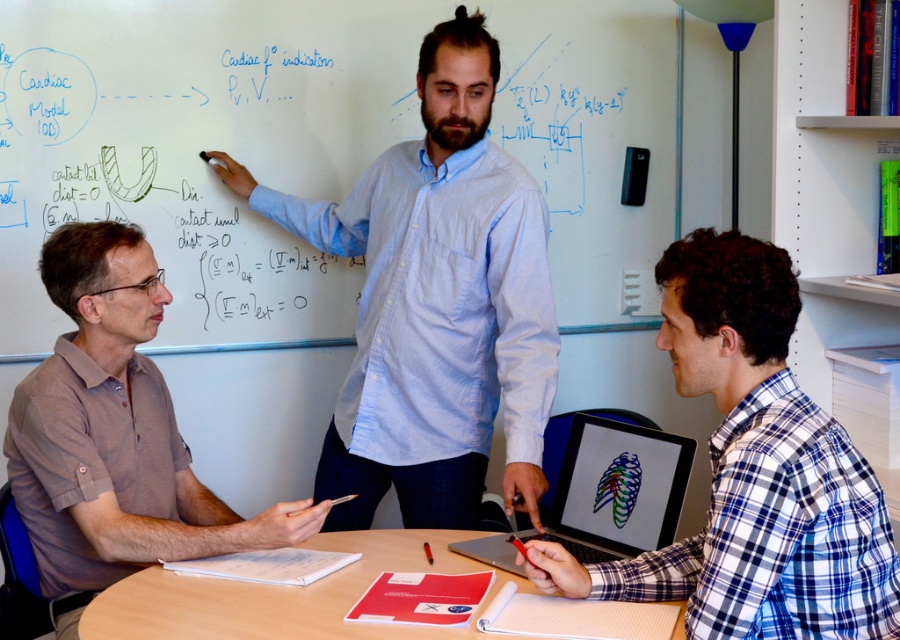
Question: Can you confirm if brown cotton shirt at left is bigger than smooth wooden table at center?

Choices:
 (A) yes
 (B) no

Answer: (A)

Question: Is blue plaid shirt at center smaller than matte plastic laptop at center?

Choices:
 (A) no
 (B) yes

Answer: (A)

Question: Among these objects, which one is farthest from the camera?

Choices:
 (A) blue plaid shirt at center
 (B) brown cotton shirt at left
 (C) smooth wooden table at center

Answer: (B)

Question: Is brown cotton shirt at left bigger than smooth wooden table at center?

Choices:
 (A) no
 (B) yes

Answer: (B)

Question: Which object is farther from the camera taking this photo?

Choices:
 (A) matte plastic laptop at center
 (B) whiteboard at upper center
 (C) blue plaid shirt at center
 (D) smooth wooden table at center

Answer: (B)

Question: Among these objects, which one is nearest to the camera?

Choices:
 (A) whiteboard at upper center
 (B) brown cotton shirt at left
 (C) smooth wooden table at center
 (D) light blue striped shirt at center

Answer: (C)